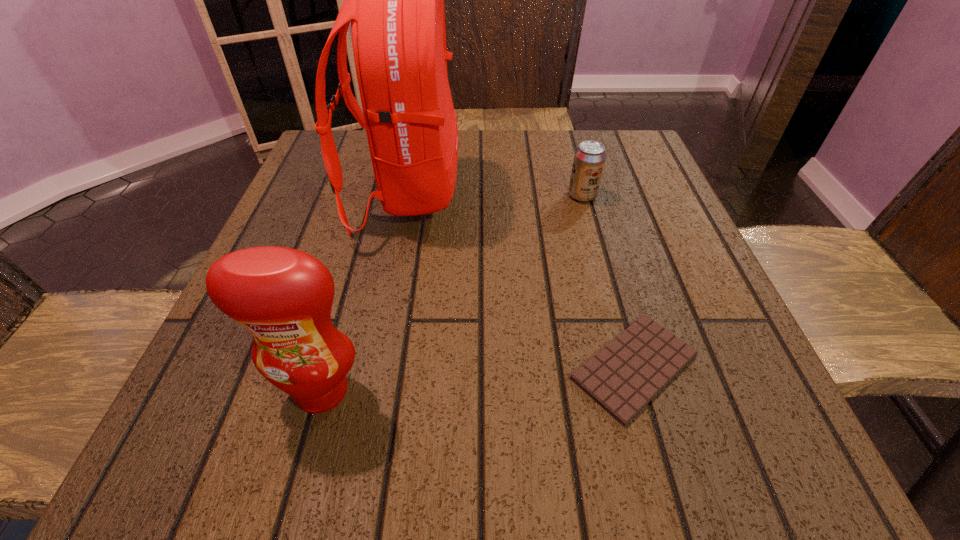
Identify the location of vacant space at the left edge of the desktop. (288, 197).

At what (x,y) coordinates should I click in order to perform the action: click on vacant region at the right edge of the desktop. Please return your answer as a coordinate pair (x, y). This screenshot has height=540, width=960. Looking at the image, I should click on (719, 294).

Image resolution: width=960 pixels, height=540 pixels. What are the coordinates of `vacant space at the far left corner of the desktop` in the screenshot? It's located at (362, 177).

Image resolution: width=960 pixels, height=540 pixels. I want to click on free space at the near left corner, so click(173, 438).

Locate an element on the screen. The image size is (960, 540). free space at the far right corner is located at coordinates (580, 137).

Image resolution: width=960 pixels, height=540 pixels. I want to click on vacant space that is in between the second tallest object and the tallest object, so click(364, 292).

I want to click on empty location between the second shortest object and the shortest object, so click(609, 281).

What are the coordinates of `free space that is in between the backpack and the shortest object` in the screenshot? It's located at (520, 280).

In order to click on free spot between the beer can and the chocolate bar in this screenshot , I will do `click(609, 281)`.

At what (x,y) coordinates should I click in order to perform the action: click on vacant area that lies between the second tallest object and the backpack. Please return your answer as a coordinate pair (x, y). Image resolution: width=960 pixels, height=540 pixels. Looking at the image, I should click on (364, 292).